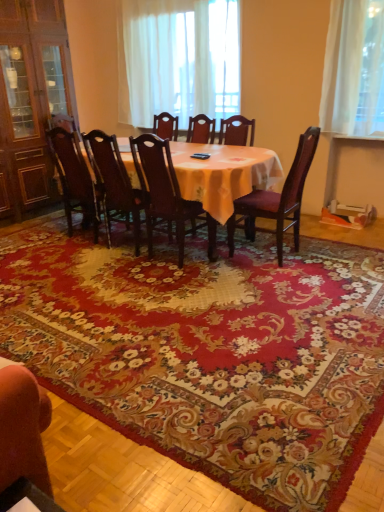
Question: Would you say wooden chair at center, the third chair from the left, is inside or outside dark wood chair at center, which is the fourth chair in right-to-left order?

Choices:
 (A) outside
 (B) inside

Answer: (A)

Question: From the image's perspective, is wooden chair at center, the third chair viewed from the right, positioned above or below dark wood chair at center, which is the fourth chair in right-to-left order?

Choices:
 (A) below
 (B) above

Answer: (A)

Question: Based on their relative distances, which object is nearer to the wooden cabinet at left?

Choices:
 (A) wooden table at center
 (B) wooden chair with purple cushion at right, placed as the 1th chair when sorted from right to left
 (C) wooden chair at center, the fourth chair from the left
 (D) wooden chair at center, the third chair viewed from the right
 (E) floral carpet at center

Answer: (D)

Question: Which object is positioned farthest from the wooden chair at center, the third chair from the left?

Choices:
 (A) dark wood chair at center, the 2th chair when ordered from left to right
 (B) floral carpet at center
 (C) dark brown wood chair at center, which ranks as the 1th chair in left-to-right order
 (D) white sheer curtain at upper center
 (E) wooden cabinet at left

Answer: (E)